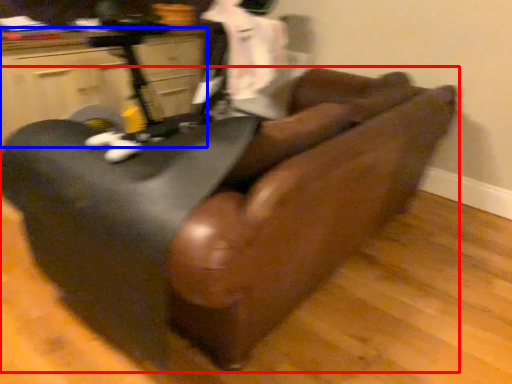
Question: Among these objects, which one is farthest to the camera, furniture (highlighted by a red box) or furniture (highlighted by a blue box)?

Choices:
 (A) furniture
 (B) furniture

Answer: (B)